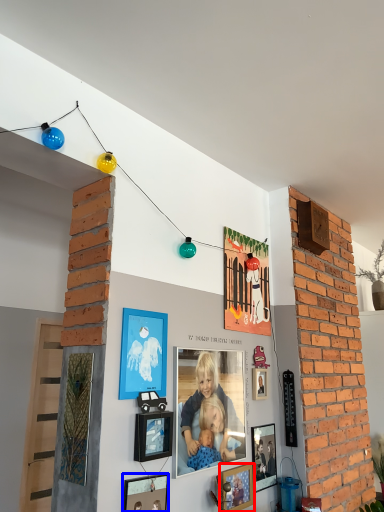
Question: Which object is further to the camera taking this photo, picture frame (highlighted by a red box) or picture frame (highlighted by a blue box)?

Choices:
 (A) picture frame
 (B) picture frame

Answer: (A)